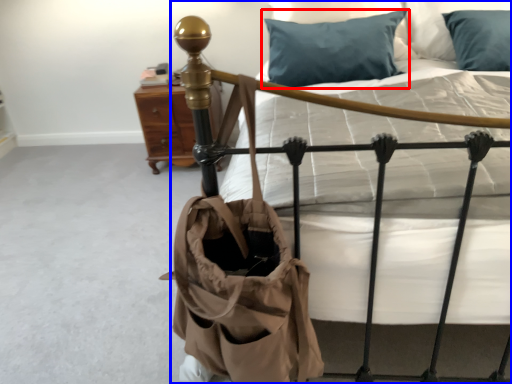
Question: Which object appears farthest to the camera in this image, pillow (highlighted by a red box) or bed (highlighted by a blue box)?

Choices:
 (A) pillow
 (B) bed

Answer: (A)